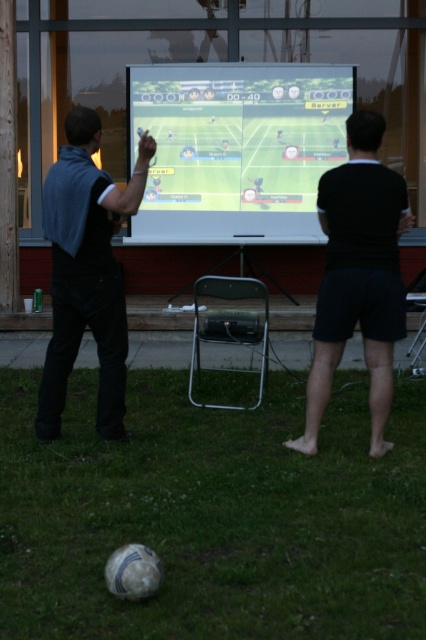
Question: Which point is farther to the camera?

Choices:
 (A) (244, 113)
 (B) (348, 300)
 (C) (106, 408)

Answer: (A)

Question: Is black matte shorts at center to the left of dark blue fabric at left from the viewer's perspective?

Choices:
 (A) yes
 (B) no

Answer: (B)

Question: Which object is positioned farthest from the white glossy projection screen at center?

Choices:
 (A) black matte shorts at center
 (B) dark blue fabric at left

Answer: (A)

Question: Is white glossy projection screen at center wider than dark blue fabric at left?

Choices:
 (A) yes
 (B) no

Answer: (A)

Question: Among these points, which one is nearest to the camera?

Choices:
 (A) (284, 202)
 (B) (58, 237)

Answer: (B)

Question: Does white glossy projection screen at center come behind black matte shorts at center?

Choices:
 (A) yes
 (B) no

Answer: (A)